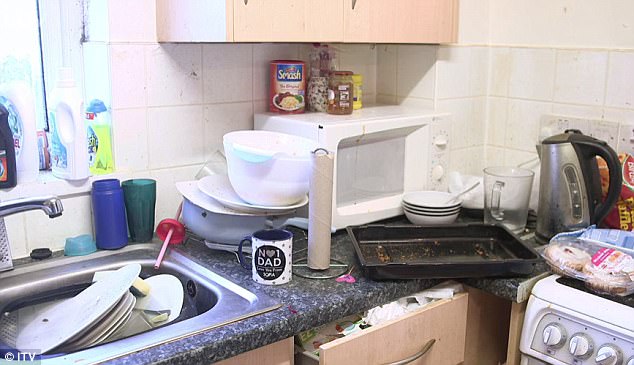
The height and width of the screenshot is (365, 634). Identify the location of drawer handle. (425, 349).